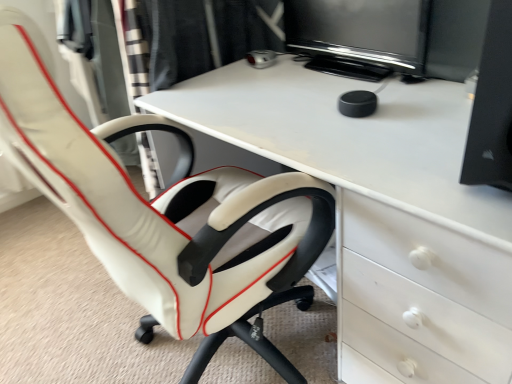
Question: Should I look upward or downward to see white leather chair at left?

Choices:
 (A) down
 (B) up

Answer: (A)

Question: Considering the relative sizes of black glossy monitor at upper center and white leather chair at left in the image provided, is black glossy monitor at upper center bigger than white leather chair at left?

Choices:
 (A) yes
 (B) no

Answer: (B)

Question: Is black glossy monitor at upper center oriented towards white leather chair at left?

Choices:
 (A) no
 (B) yes

Answer: (B)

Question: Does black glossy monitor at upper center appear on the right side of white leather chair at left?

Choices:
 (A) yes
 (B) no

Answer: (A)

Question: Considering the relative sizes of black glossy monitor at upper center and white leather chair at left in the image provided, is black glossy monitor at upper center wider than white leather chair at left?

Choices:
 (A) yes
 (B) no

Answer: (B)

Question: Is black glossy monitor at upper center looking in the opposite direction of white leather chair at left?

Choices:
 (A) yes
 (B) no

Answer: (B)

Question: From the image's perspective, is black glossy monitor at upper center above white leather chair at left?

Choices:
 (A) yes
 (B) no

Answer: (A)

Question: From the image's perspective, is white leather chair at left beneath white glossy desk at center?

Choices:
 (A) no
 (B) yes

Answer: (A)

Question: From the image's perspective, is white leather chair at left over white glossy desk at center?

Choices:
 (A) yes
 (B) no

Answer: (A)

Question: Is the position of white leather chair at left less distant than that of white glossy desk at center?

Choices:
 (A) yes
 (B) no

Answer: (A)

Question: Does white leather chair at left have a smaller size compared to white glossy desk at center?

Choices:
 (A) yes
 (B) no

Answer: (A)

Question: From a real-world perspective, is white leather chair at left under white glossy desk at center?

Choices:
 (A) yes
 (B) no

Answer: (B)

Question: Is white leather chair at left to the left of white glossy desk at center from the viewer's perspective?

Choices:
 (A) no
 (B) yes

Answer: (B)

Question: Does black glossy monitor at upper center have a larger size compared to white glossy desk at center?

Choices:
 (A) no
 (B) yes

Answer: (A)